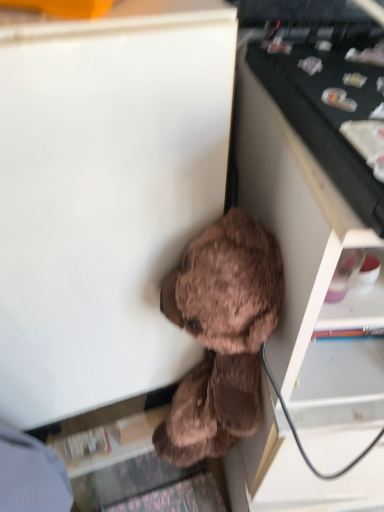
This screenshot has width=384, height=512. Describe the element at coordinates (105, 198) in the screenshot. I see `brown plush toy at lower right` at that location.

What is the approximate width of brown plush toy at lower right?

It is 13.20 inches.

Where is `brown plush toy at lower right`? brown plush toy at lower right is located at coordinates (105, 198).

Image resolution: width=384 pixels, height=512 pixels. I want to click on brown plush toy at lower right, so click(105, 198).